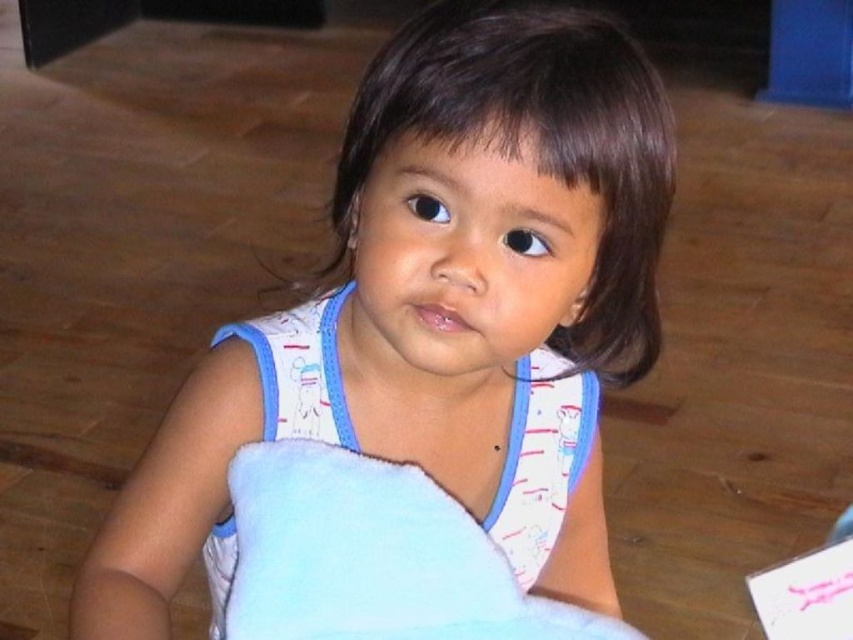
Question: Among these objects, which one is nearest to the camera?

Choices:
 (A) blue soft blanket at center
 (B) white soft blanket at center

Answer: (A)

Question: Observing the image, what is the correct spatial positioning of white soft blanket at center in reference to blue soft blanket at center?

Choices:
 (A) right
 (B) left

Answer: (A)

Question: Which point is farther to the camera?

Choices:
 (A) blue soft blanket at center
 (B) white soft blanket at center

Answer: (B)

Question: Observing the image, what is the correct spatial positioning of white soft blanket at center in reference to blue soft blanket at center?

Choices:
 (A) left
 (B) right

Answer: (B)

Question: Does white soft blanket at center have a smaller size compared to blue soft blanket at center?

Choices:
 (A) no
 (B) yes

Answer: (A)